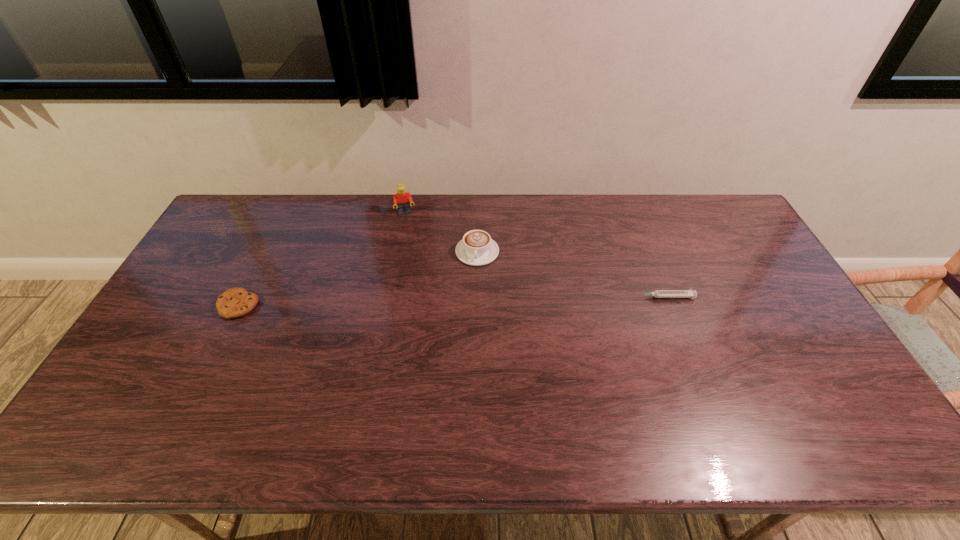
In order to click on vacant area located 0.230m at the needle end of the syringe in this screenshot , I will do `click(558, 297)`.

Locate an element on the screen. Image resolution: width=960 pixels, height=540 pixels. free location located 0.100m with the handle on the right side of the third shortest object is located at coordinates (479, 290).

This screenshot has width=960, height=540. What are the coordinates of `vacant area situated with the handle on the right side of the third shortest object` in the screenshot? It's located at (481, 359).

The width and height of the screenshot is (960, 540). In order to click on vacant region located 0.350m with the handle on the right side of the third shortest object in this screenshot , I will do `click(481, 359)`.

The image size is (960, 540). I want to click on free region located 0.330m on the face of the Lego, so pos(421,282).

Find the location of `vacant space located 0.270m on the face of the Lego`. vacant space located 0.270m on the face of the Lego is located at coordinates (419, 269).

Identify the location of vacant space situated on the face of the Lego. (414, 247).

Find the location of a particular element. This screenshot has height=540, width=960. object present at the far edge is located at coordinates (403, 199).

The image size is (960, 540). Find the location of `object that is at the left edge`. object that is at the left edge is located at coordinates (235, 302).

I want to click on free space at the far edge, so click(415, 218).